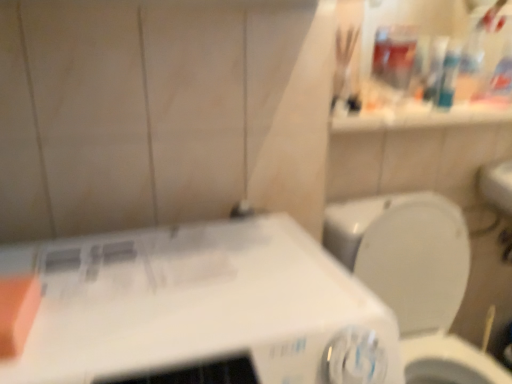
Question: From the image's perspective, is white glossy toilet at right located beneath white plastic washing machine at lower left?

Choices:
 (A) no
 (B) yes

Answer: (B)

Question: Is white glossy toilet at right at the left side of white plastic washing machine at lower left?

Choices:
 (A) yes
 (B) no

Answer: (B)

Question: Is white glossy toilet at right to the right of white plastic washing machine at lower left from the viewer's perspective?

Choices:
 (A) no
 (B) yes

Answer: (B)

Question: Is the depth of white glossy toilet at right greater than that of white plastic washing machine at lower left?

Choices:
 (A) no
 (B) yes

Answer: (B)

Question: Is white glossy toilet at right facing towards white plastic washing machine at lower left?

Choices:
 (A) no
 (B) yes

Answer: (A)

Question: From a real-world perspective, is white glossy toilet at right over white plastic washing machine at lower left?

Choices:
 (A) yes
 (B) no

Answer: (B)

Question: Is white glossy toilet at right outside orange matte soap at left?

Choices:
 (A) no
 (B) yes

Answer: (B)

Question: Would you say orange matte soap at left is part of white glossy toilet at right's contents?

Choices:
 (A) yes
 (B) no

Answer: (B)

Question: Considering the relative sizes of white glossy toilet at right and orange matte soap at left in the image provided, is white glossy toilet at right thinner than orange matte soap at left?

Choices:
 (A) no
 (B) yes

Answer: (A)

Question: Is white glossy toilet at right shorter than orange matte soap at left?

Choices:
 (A) yes
 (B) no

Answer: (B)

Question: From the image's perspective, would you say white glossy toilet at right is positioned over orange matte soap at left?

Choices:
 (A) no
 (B) yes

Answer: (A)

Question: Are white glossy toilet at right and orange matte soap at left far apart?

Choices:
 (A) yes
 (B) no

Answer: (B)

Question: Is the position of white plastic washing machine at lower left less distant than that of orange matte soap at left?

Choices:
 (A) yes
 (B) no

Answer: (A)